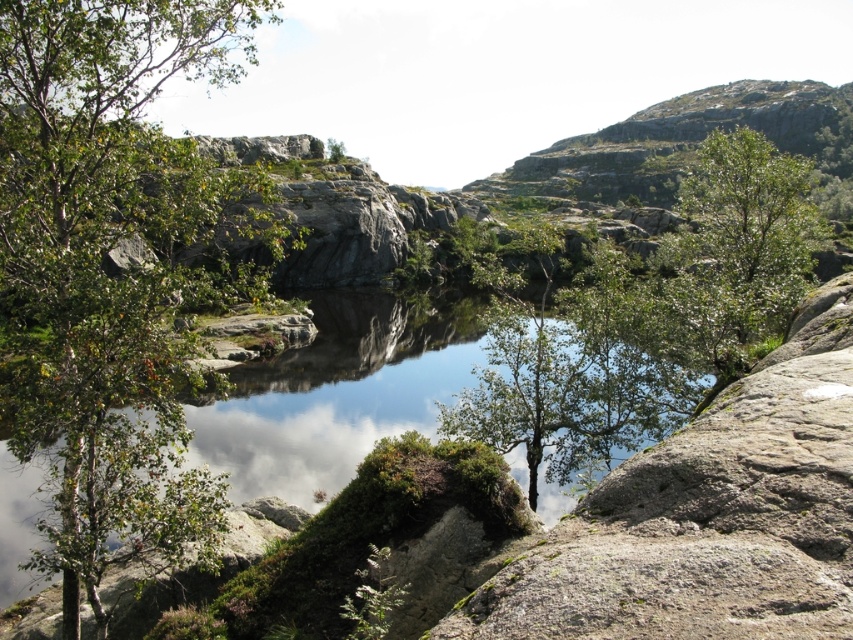
Is clear water at center wider than green leafy tree at center?

Incorrect, clear water at center's width does not surpass green leafy tree at center's.

Does point (445, 291) come closer to viewer compared to point (502, 397)?

No, (445, 291) is behind (502, 397).

This screenshot has height=640, width=853. In order to click on clear water at center in this screenshot , I will do `click(339, 392)`.

Who is shorter, clear water at center or green leafy tree at upper right?

clear water at center is shorter.

Is point (7, 570) positioned before point (686, 285)?

No, it is behind (686, 285).

Locate an element on the screen. This screenshot has height=640, width=853. clear water at center is located at coordinates (339, 392).

Can you confirm if green leafy tree at left is wider than clear water at center?

Correct, the width of green leafy tree at left exceeds that of clear water at center.

Between green leafy tree at left and clear water at center, which one appears on the left side from the viewer's perspective?

green leafy tree at left is more to the left.

Locate an element on the screen. The width and height of the screenshot is (853, 640). green leafy tree at left is located at coordinates (114, 262).